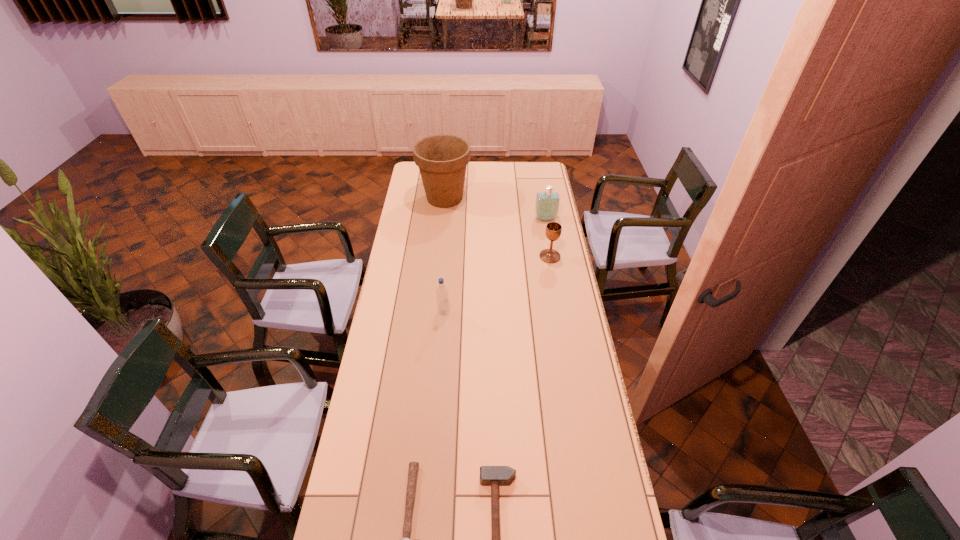
Locate an element on the screen. The height and width of the screenshot is (540, 960). perfume that is at the right edge is located at coordinates (547, 203).

Locate an element on the screen. chalice located in the right edge section of the desktop is located at coordinates (553, 230).

At what (x,y) coordinates should I click in order to perform the action: click on vacant space at the far edge of the desktop. Please return your answer as a coordinate pair (x, y). Looking at the image, I should click on (479, 171).

You are a GUI agent. You are given a task and a screenshot of the screen. Output one action in this format:
    pyautogui.click(x=<x>, y=<y>)
    Task: Click on the free region at the left edge
    This screenshot has height=540, width=960.
    Given the screenshot: What is the action you would take?
    pyautogui.click(x=412, y=214)

Locate an element on the screen. The width and height of the screenshot is (960, 540). free space at the right edge of the desktop is located at coordinates (567, 308).

Find the location of `free space at the far right corner of the desktop`. free space at the far right corner of the desktop is located at coordinates (526, 182).

Locate an element on the screen. vacant area that lies between the perfume and the third nearest object is located at coordinates (494, 266).

Locate an element on the screen. The height and width of the screenshot is (540, 960). vacant area that lies between the water bottle and the tallest object is located at coordinates (444, 255).

This screenshot has width=960, height=540. Find the location of `empty space between the chalice and the water bottle`. empty space between the chalice and the water bottle is located at coordinates (497, 285).

What are the coordinates of `object that can be found as the third closest to the shorter hammer` in the screenshot? It's located at (553, 230).